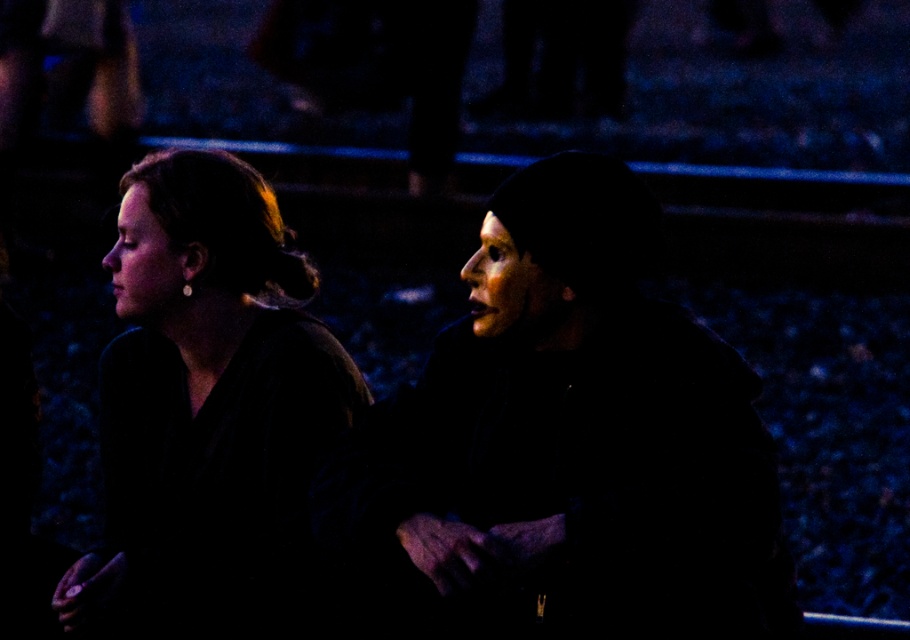
Which is more to the right, black matte coat at center or matte brown coat at left?

Positioned to the right is black matte coat at center.

Is black matte coat at center shorter than matte brown coat at left?

Yes.

Locate an element on the screen. Image resolution: width=910 pixels, height=640 pixels. black matte coat at center is located at coordinates (593, 435).

Find the location of a particular element. black matte coat at center is located at coordinates (593, 435).